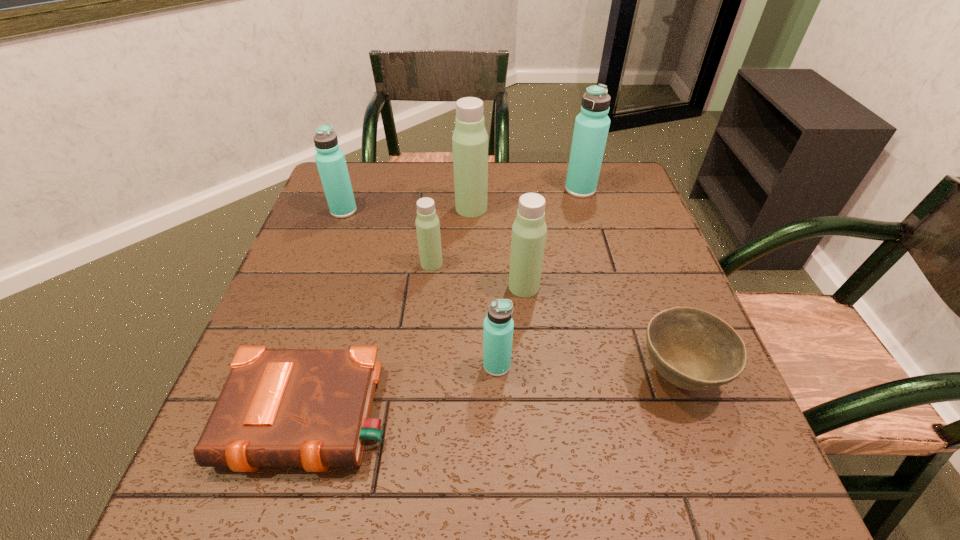
The image size is (960, 540). I want to click on the second aqua thermos bottle from left to right, so point(498,328).

Find the location of a particular element. This screenshot has height=540, width=960. the nearest thermos bottle is located at coordinates (498, 328).

Locate an element on the screen. This screenshot has width=960, height=540. bowl is located at coordinates (695, 350).

This screenshot has width=960, height=540. Identify the location of Bible. (310, 408).

Where is `free space located on the front of the farthest object`? Image resolution: width=960 pixels, height=540 pixels. free space located on the front of the farthest object is located at coordinates (x=589, y=222).

This screenshot has height=540, width=960. What are the coordinates of `vacant space situated 0.350m on the front of the biggest light thermos bottle` in the screenshot? It's located at [468, 318].

This screenshot has width=960, height=540. Find the location of `free space located on the right of the second smallest aqua thermos bottle`. free space located on the right of the second smallest aqua thermos bottle is located at coordinates (415, 211).

This screenshot has height=540, width=960. What are the coordinates of `free region located 0.310m on the front of the second smallest light thermos bottle` in the screenshot? It's located at (538, 430).

Locate an element on the screen. The height and width of the screenshot is (540, 960). free space located on the front of the third object from left to right is located at coordinates (425, 317).

The width and height of the screenshot is (960, 540). In order to click on vacant point located 0.070m on the front of the smallest aqua thermos bottle in this screenshot , I will do (x=498, y=411).